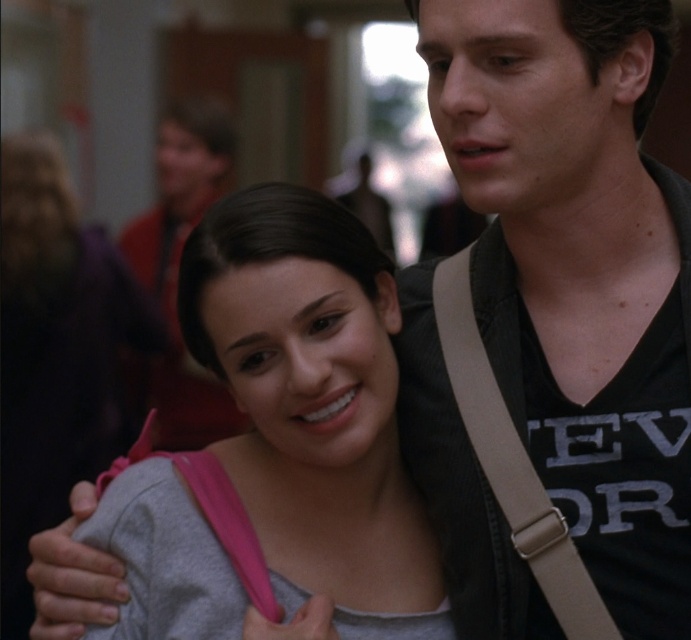
Does gray matte tank top at center have a greater width compared to tan fabric strap at center?

Yes, gray matte tank top at center is wider than tan fabric strap at center.

From the picture: Is gray matte tank top at center to the left of tan fabric strap at center from the viewer's perspective?

Indeed, gray matte tank top at center is positioned on the left side of tan fabric strap at center.

In order to click on gray matte tank top at center in this screenshot , I will do pyautogui.click(x=312, y=404).